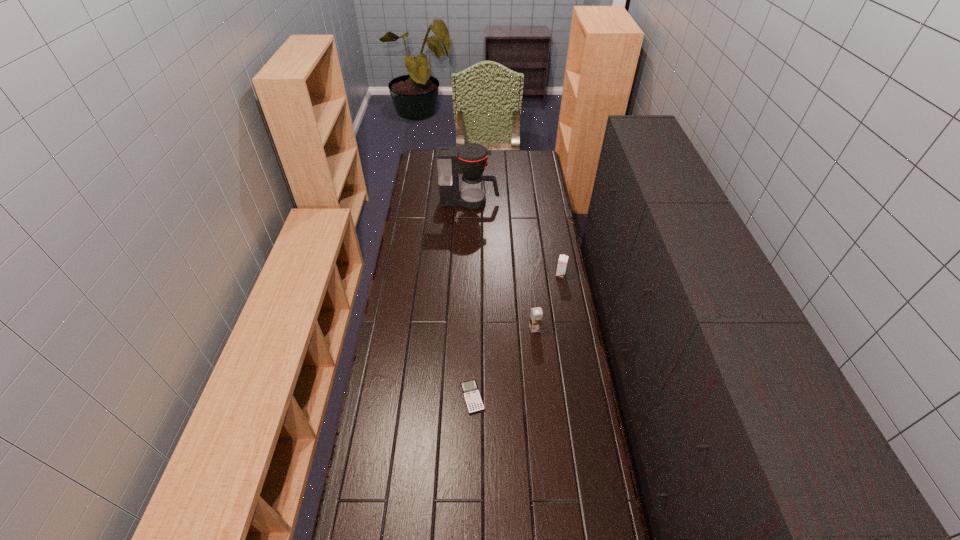
This screenshot has width=960, height=540. Find the location of `vacant region that satisfies the following two spatial constraints: 1. pour from the carafe of the tallest object; 2. on the left side of the calculator`. vacant region that satisfies the following two spatial constraints: 1. pour from the carafe of the tallest object; 2. on the left side of the calculator is located at coordinates (465, 397).

The height and width of the screenshot is (540, 960). What are the coordinates of `vacant region that satisfies the following two spatial constraints: 1. pour from the carafe of the tallest object; 2. on the left side of the nearer chocolate milk` in the screenshot? It's located at (467, 328).

Where is `vacant space that satisfies the following two spatial constraints: 1. pour from the carafe of the third object from left to right; 2. on the right side of the coffee maker`? This screenshot has height=540, width=960. vacant space that satisfies the following two spatial constraints: 1. pour from the carafe of the third object from left to right; 2. on the right side of the coffee maker is located at coordinates (467, 328).

Locate an element on the screen. vacant space that satisfies the following two spatial constraints: 1. pour from the carafe of the rightmost object; 2. on the right side of the tallest object is located at coordinates (x=468, y=275).

Find the location of `vacant space that satisfies the following two spatial constraints: 1. on the back side of the nearest object; 2. pour from the carafe of the tallest object`. vacant space that satisfies the following two spatial constraints: 1. on the back side of the nearest object; 2. pour from the carafe of the tallest object is located at coordinates (475, 202).

Locate an element on the screen. vacant space that satisfies the following two spatial constraints: 1. pour from the carafe of the nearer chocolate milk; 2. on the right side of the tallest object is located at coordinates (467, 328).

In order to click on vacant region that satisfies the following two spatial constraints: 1. pour from the carafe of the coffee maker; 2. on the back side of the farther chocolate milk in this screenshot , I will do `click(468, 275)`.

Where is `free space that satisfies the following two spatial constraints: 1. on the back side of the farther chocolate milk; 2. pour from the carafe of the tallest object`? free space that satisfies the following two spatial constraints: 1. on the back side of the farther chocolate milk; 2. pour from the carafe of the tallest object is located at coordinates (547, 202).